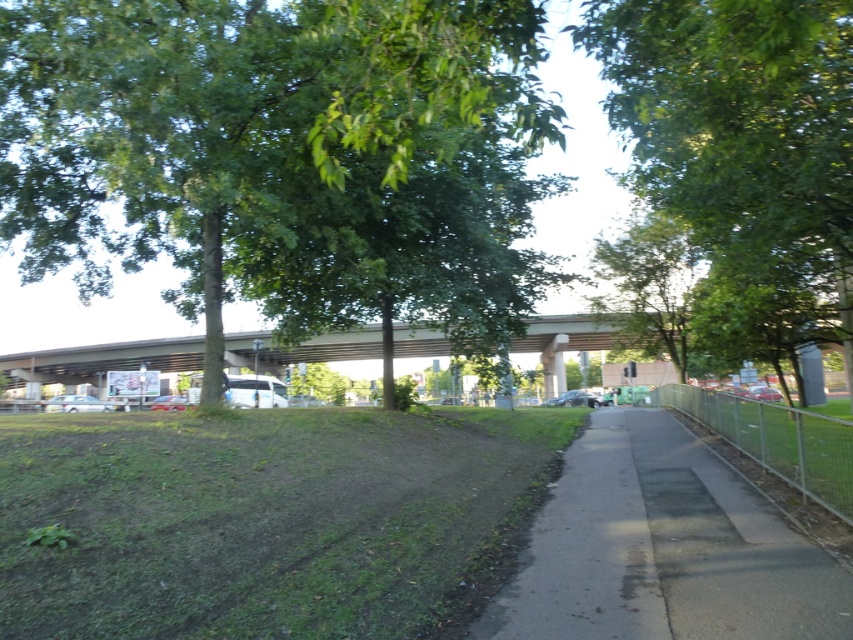
Who is shorter, white matte car at lower left or matte silver van at lower left?

white matte car at lower left

Is white matte car at lower left shorter than matte silver van at lower left?

Indeed, white matte car at lower left has a lesser height compared to matte silver van at lower left.

Between point (70, 410) and point (160, 396), which one is positioned behind?

Positioned behind is point (160, 396).

At what (x,y) coordinates should I click in order to perform the action: click on white matte car at lower left. Please return your answer as a coordinate pair (x, y). Image resolution: width=853 pixels, height=640 pixels. Looking at the image, I should click on (77, 403).

Between green leafy tree at center and smooth asphalt path at center, which one is positioned higher?

Positioned higher is green leafy tree at center.

Is green leafy tree at center above smooth asphalt path at center?

Yes.

Which is in front, point (782, 28) or point (637, 572)?

Positioned in front is point (782, 28).

I want to click on green leafy tree at center, so click(x=735, y=116).

Which of these two, smooth asphalt path at center or matte silver van at lower left, stands shorter?

With less height is smooth asphalt path at center.

Who is higher up, smooth asphalt path at center or matte silver van at lower left?

smooth asphalt path at center is above.

Is point (614, 454) positioned before point (177, 397)?

Yes.

You are a GUI agent. You are given a task and a screenshot of the screen. Output one action in this format:
    pyautogui.click(x=<x>, y=<y>)
    Task: Click on the smooth asphalt path at center
    The width and height of the screenshot is (853, 640).
    Given the screenshot: What is the action you would take?
    pyautogui.click(x=663, y=548)